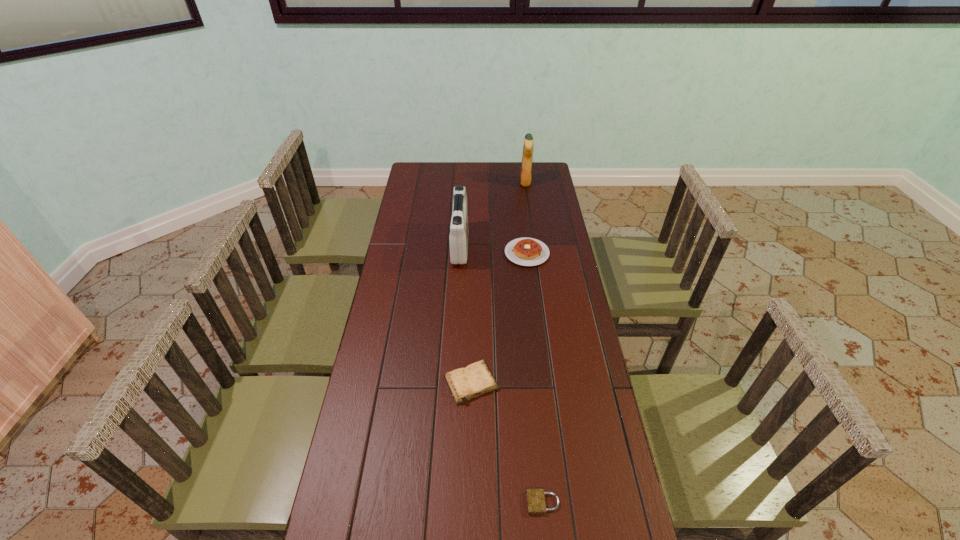
This screenshot has width=960, height=540. Find the location of `vacant point located 0.060m on the front side of the second tallest object`. vacant point located 0.060m on the front side of the second tallest object is located at coordinates (483, 246).

Where is `vacant space located on the front of the pancake`? vacant space located on the front of the pancake is located at coordinates (530, 280).

The width and height of the screenshot is (960, 540). I want to click on vacant region located on the front of the diary, so [x=468, y=528].

Image resolution: width=960 pixels, height=540 pixels. Identify the location of free location located on the keyhole side of the shortest object. (408, 502).

You are a GUI agent. You are given a task and a screenshot of the screen. Output one action in this format:
    pyautogui.click(x=<x>, y=<y>)
    Task: Click on the vacant area situated on the keyhole side of the shortest object
    The width and height of the screenshot is (960, 540).
    Given the screenshot: What is the action you would take?
    click(507, 502)

Locate an element on the screen. The width and height of the screenshot is (960, 540). blank space located 0.050m on the keyhole side of the shortest object is located at coordinates (507, 502).

Locate an element on the screen. Image resolution: width=960 pixels, height=540 pixels. object situated at the far edge is located at coordinates (525, 175).

Image resolution: width=960 pixels, height=540 pixels. In order to click on detergent situated at the right edge in this screenshot , I will do `click(525, 175)`.

This screenshot has height=540, width=960. What are the coordinates of `pancake located in the right edge section of the desktop` in the screenshot? It's located at (525, 251).

The width and height of the screenshot is (960, 540). In order to click on object positioned at the far right corner in this screenshot , I will do `click(525, 175)`.